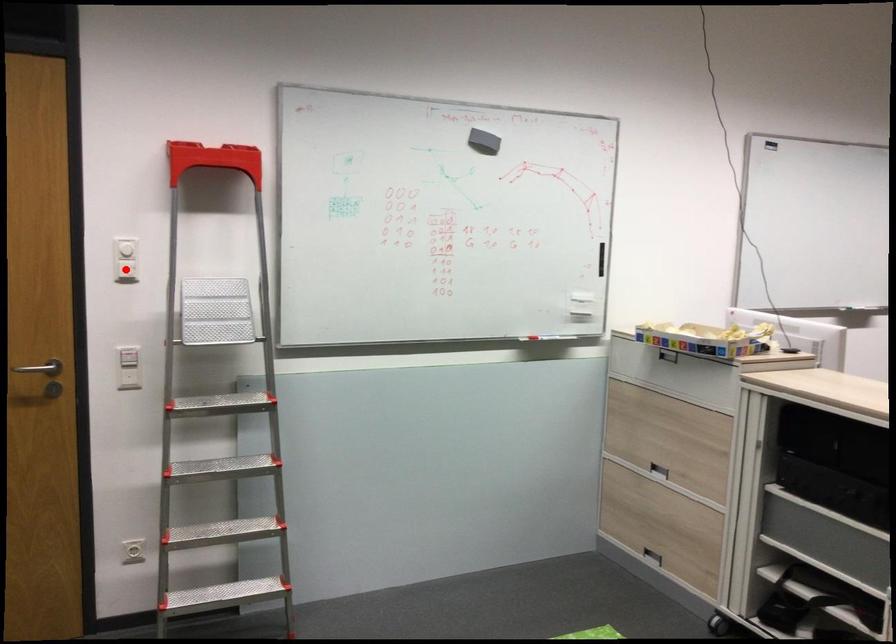
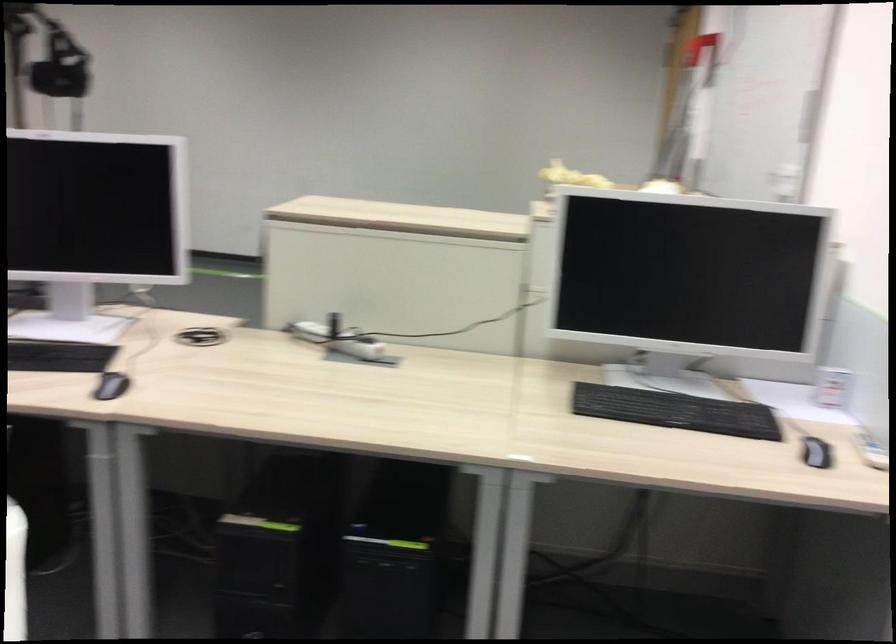
Question: I am providing you with two images of the same scene from different viewpoints. A red point is marked on the first image. Can you still see the location of the red point in image 2?

Choices:
 (A) Yes
 (B) No

Answer: (B)